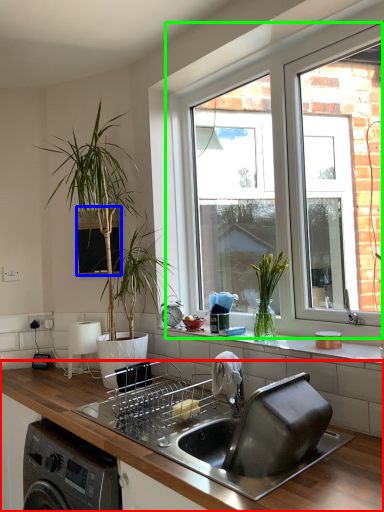
Question: Which object is positioned farthest from countertop (highlighted by a red box)? Select from window screen (highlighted by a blue box) and window (highlighted by a green box).

Choices:
 (A) window screen
 (B) window

Answer: (B)